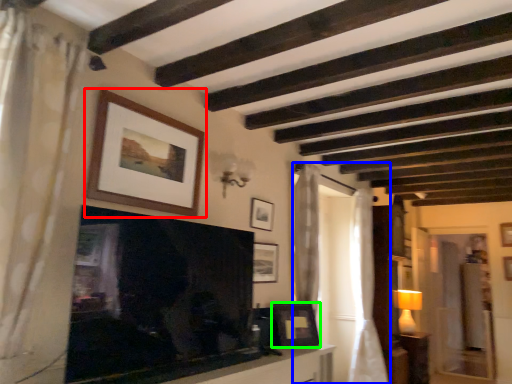
Question: Considering the real-world distances, which object is closest to picture frame (highlighted by a red box)? curtain (highlighted by a blue box) or picture frame (highlighted by a green box).

Choices:
 (A) curtain
 (B) picture frame

Answer: (B)